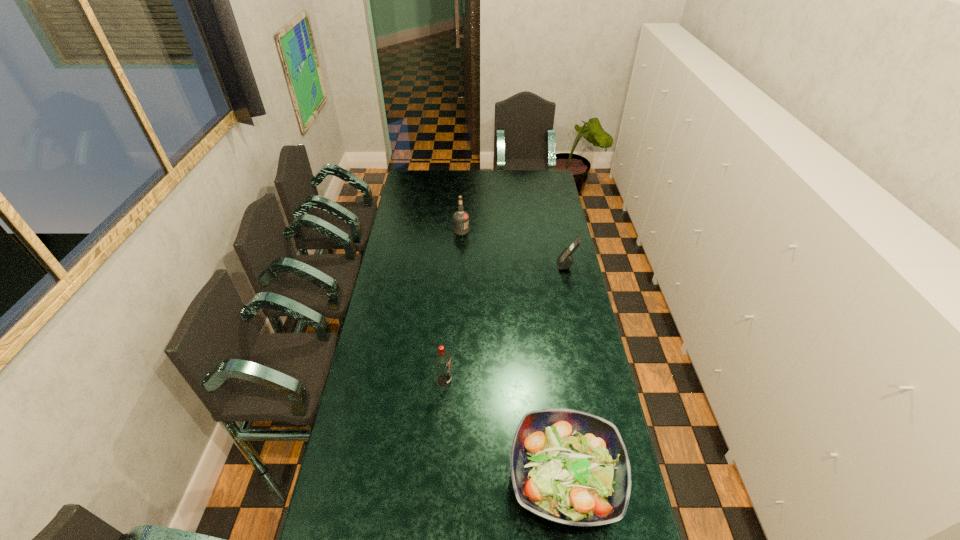
Identify which object is located as the nearest to the shortest object. Please provide its 2D coordinates. Your answer should be formatted as a tuple, i.e. [(x, y)], where the tuple contains the x and y coordinates of a point satisfying the conditions above.

[(442, 360)]

Where is `vacant point that satisfies the following two spatial constraints: 1. on the front label of the farthest object; 2. on the back side of the salad plate`? The height and width of the screenshot is (540, 960). vacant point that satisfies the following two spatial constraints: 1. on the front label of the farthest object; 2. on the back side of the salad plate is located at coordinates pyautogui.click(x=449, y=477).

The image size is (960, 540). Find the location of `free region that satisfies the following two spatial constraints: 1. on the front label of the nearest object; 2. on the right side of the farthest object`. free region that satisfies the following two spatial constraints: 1. on the front label of the nearest object; 2. on the right side of the farthest object is located at coordinates coord(449,477).

Identify the location of free spot that satisfies the following two spatial constraints: 1. on the front label of the nearer vodka; 2. on the back side of the nearest object. (438, 477).

Locate an element on the screen. This screenshot has height=540, width=960. free space that satisfies the following two spatial constraints: 1. on the front label of the farther vodka; 2. on the back side of the shortest object is located at coordinates (449, 477).

Where is `free space that satisfies the following two spatial constraints: 1. on the front label of the salad plate; 2. on the right side of the farthest object`? The height and width of the screenshot is (540, 960). free space that satisfies the following two spatial constraints: 1. on the front label of the salad plate; 2. on the right side of the farthest object is located at coordinates (449, 477).